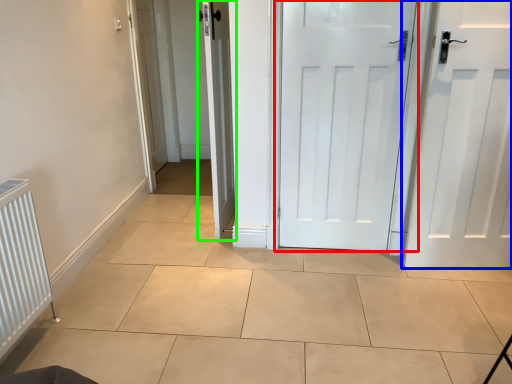
Question: Considering the real-world distances, which object is farthest from door (highlighted by a red box)? door (highlighted by a blue box) or door (highlighted by a green box)?

Choices:
 (A) door
 (B) door

Answer: (B)